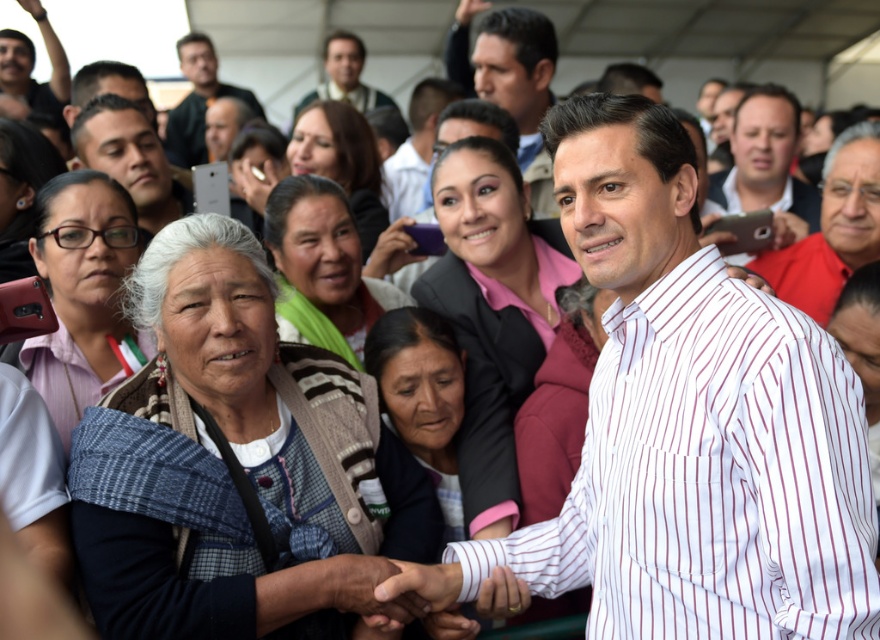
You are standing at the point marked by the coordinates (511, 81) in the image. What can you see immediately around you?

The point at (511, 81) corresponds to smooth brown hair at center, so you would see smooth brown hair around you.

You are a photographer at the event and want to capture a closeup of both the smooth brown hair at center and the purple matte phone at center. Since your camera can only focus on one object at a time, which object should you focus on first to ensure it appears larger in the photo?

The smooth brown hair at center is bigger than the purple matte phone at center, so you should focus on the smooth brown hair at center first to ensure it appears larger in the photo.

You are a photographer at this event and want to capture a photo that includes both the white striped shirt at center and the matte black shirt at upper left. Given their heights, which shirt should you focus on first to ensure both are in frame?

The white striped shirt at center is taller than the matte black shirt at upper left, so you should focus on positioning the camera to include the taller white striped shirt at center first, ensuring the shorter matte black shirt at upper left will naturally fit into the frame.